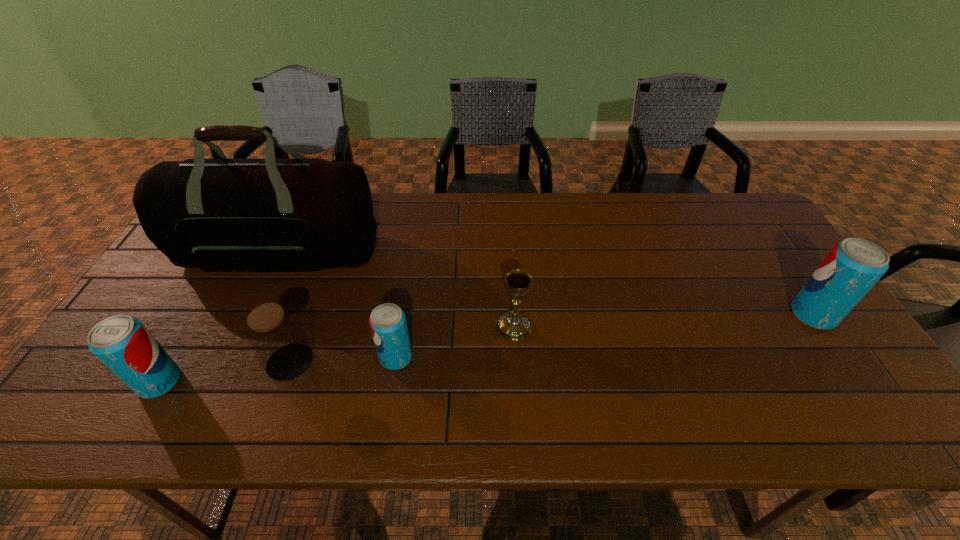
If we want them evenly spaced by inserting an extra pop_(soda) among them, please locate a free spot for this new pop_(soda). Please provide its 2D coordinates. Your answer should be formatted as a tuple, i.e. [(x, y)], where the tuple contains the x and y coordinates of a point satisfying the conditions above.

[(613, 335)]